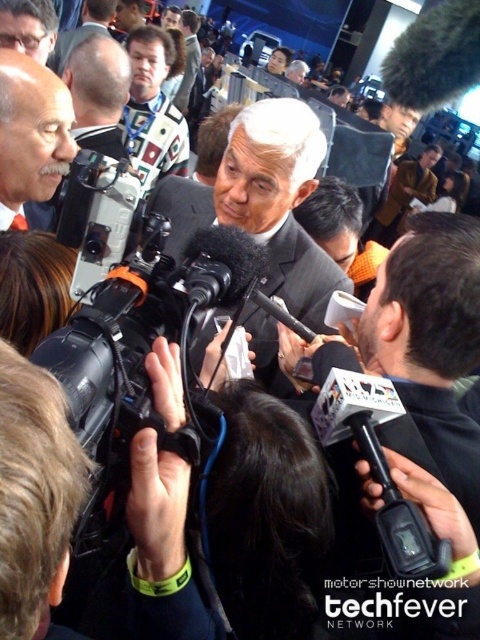
You are a photographer at the event and need to capture a clear photo of the speaker. Given the white textured shirt at center and the light brown suit at center, which one should you focus on to ensure the subject takes up more of the frame?

The light brown suit at center occupies more space than the white textured shirt at center, so focusing on the light brown suit at center will ensure the subject takes up more of the frame.

You are attending a press conference and notice two men in suits at the center of the room. The dark gray suit at center and the light brown suit at center. Which of the two suits is shorter?

The dark gray suit at center is not as tall as light brown suit at center, so the dark gray suit at center is shorter.